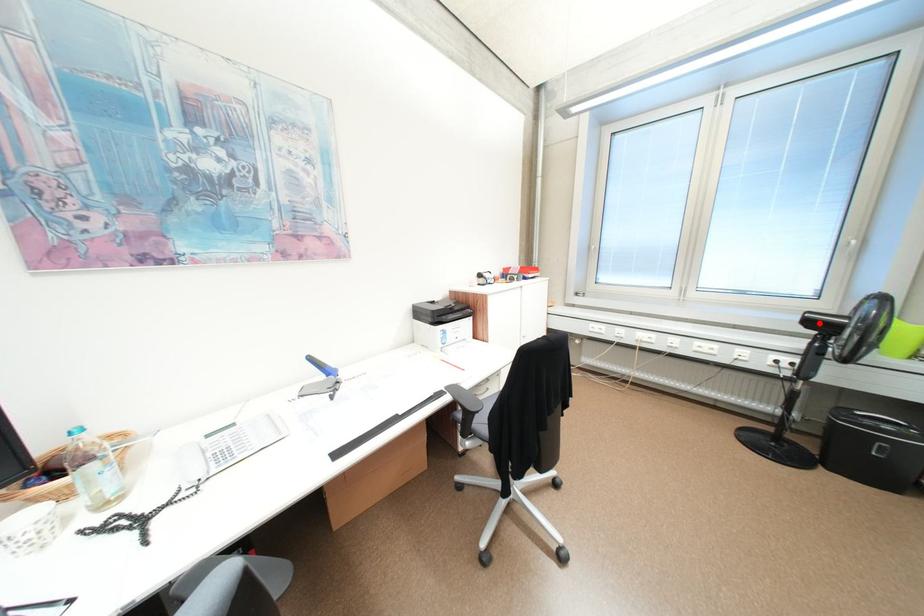
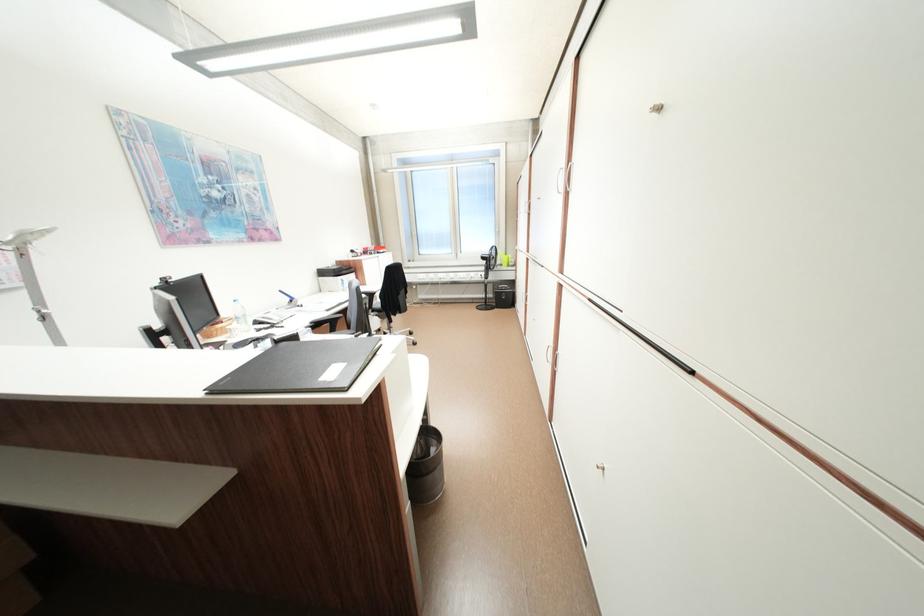
Question: I am providing you with two images of the same scene from different viewpoints. Given a red point in image1, look at the same physical point in image2. Is it:

Choices:
 (A) Closer to the viewpoint
 (B) Farther from the viewpoint

Answer: (A)